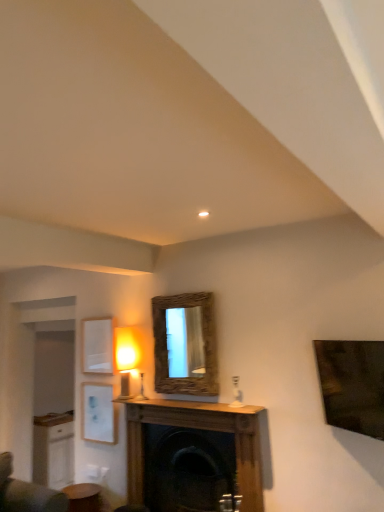
This screenshot has height=512, width=384. What do you see at coordinates (192, 455) in the screenshot?
I see `wooden fireplace at center` at bounding box center [192, 455].

This screenshot has height=512, width=384. Describe the element at coordinates (97, 346) in the screenshot. I see `white matte picture frame at upper left, the first picture frame from the top` at that location.

This screenshot has height=512, width=384. What do you see at coordinates (187, 344) in the screenshot?
I see `wooden mirror at center` at bounding box center [187, 344].

The image size is (384, 512). What do you see at coordinates (84, 497) in the screenshot?
I see `wooden table at lower left` at bounding box center [84, 497].

Measure the distance between point (x=42, y=431) and camera.

The depth of point (x=42, y=431) is 6.04 meters.

Measure the distance between white wood cabinet at lower left and camera.

5.93 meters.

Locate an element on the screen. The width and height of the screenshot is (384, 512). white matte picture frame at lower left, the 2th picture frame in the top-to-bottom sequence is located at coordinates (98, 413).

Is matte white table lamp at upper left, which is counted as the 1th table lamp, starting from the left, oriented towards wooden mirror at center?

No, matte white table lamp at upper left, which is counted as the 1th table lamp, starting from the left, is not facing towards wooden mirror at center.

Considering the sizes of objects matte white table lamp at upper left, which is counted as the 1th table lamp, starting from the left, and wooden mirror at center in the image provided, who is taller, matte white table lamp at upper left, which is counted as the 1th table lamp, starting from the left, or wooden mirror at center?

Standing taller between the two is wooden mirror at center.

Is point (134, 343) closer or farther from the camera than point (204, 309)?

Point (134, 343).

Does point (203, 416) lie in front of point (91, 362)?

That is True.

Is wooden fireplace at center positioned far away from white matte picture frame at upper left, the first picture frame from the top?

wooden fireplace at center is positioned a significant distance from white matte picture frame at upper left, the first picture frame from the top.

Is wooden fireplace at center wider than white matte picture frame at upper left, which appears as the second picture frame when ordered from the bottom?

Indeed, wooden fireplace at center has a greater width compared to white matte picture frame at upper left, which appears as the second picture frame when ordered from the bottom.

From the image's perspective, is wooden fireplace at center on top of white matte picture frame at upper left, which appears as the second picture frame when ordered from the bottom?

No, from the image's perspective, wooden fireplace at center is not over white matte picture frame at upper left, which appears as the second picture frame when ordered from the bottom.

Can you confirm if matte white table lamp at upper left, which is counted as the 1th table lamp, starting from the left, is shorter than matte white glass at center, which is counted as the second table lamp, starting from the left?

No, matte white table lamp at upper left, which is counted as the 1th table lamp, starting from the left, is not shorter than matte white glass at center, which is counted as the second table lamp, starting from the left.

Where is `table lamp that is above the matte white glass at center, acting as the 1th table lamp starting from the right (from the image's perspective)`? table lamp that is above the matte white glass at center, acting as the 1th table lamp starting from the right (from the image's perspective) is located at coordinates (126, 359).

Can you confirm if matte white table lamp at upper left, which is counted as the 1th table lamp, starting from the left, is positioned to the left of matte white glass at center, acting as the 1th table lamp starting from the right?

Correct, you'll find matte white table lamp at upper left, which is counted as the 1th table lamp, starting from the left, to the left of matte white glass at center, acting as the 1th table lamp starting from the right.

Based on the photo, is white matte picture frame at upper left, the first picture frame from the top, situated inside matte white table lamp at upper left, which is counted as the 1th table lamp, starting from the left, or outside?

The correct answer is: outside.

What's the angular difference between white matte picture frame at upper left, which appears as the second picture frame when ordered from the bottom, and matte white table lamp at upper left, the 2th table lamp viewed from the right,'s facing directions?

0.00182 degrees separate the facing orientations of white matte picture frame at upper left, which appears as the second picture frame when ordered from the bottom, and matte white table lamp at upper left, the 2th table lamp viewed from the right.

Does white matte picture frame at upper left, which appears as the second picture frame when ordered from the bottom, appear on the right side of matte white table lamp at upper left, which is counted as the 1th table lamp, starting from the left?

In fact, white matte picture frame at upper left, which appears as the second picture frame when ordered from the bottom, is to the left of matte white table lamp at upper left, which is counted as the 1th table lamp, starting from the left.

Does white matte picture frame at upper left, which appears as the second picture frame when ordered from the bottom, touch matte white table lamp at upper left, which is counted as the 1th table lamp, starting from the left?

No, white matte picture frame at upper left, which appears as the second picture frame when ordered from the bottom, is not next to matte white table lamp at upper left, which is counted as the 1th table lamp, starting from the left.

Considering the positions of objects matte white glass at center, which is counted as the second table lamp, starting from the left, and matte white table lamp at upper left, the 2th table lamp viewed from the right, in the image provided, who is in front, matte white glass at center, which is counted as the second table lamp, starting from the left, or matte white table lamp at upper left, the 2th table lamp viewed from the right,?

matte white glass at center, which is counted as the second table lamp, starting from the left, is more forward.

Is matte white glass at center, acting as the 1th table lamp starting from the right, taller than matte white table lamp at upper left, which is counted as the 1th table lamp, starting from the left?

No, matte white glass at center, acting as the 1th table lamp starting from the right, is not taller than matte white table lamp at upper left, which is counted as the 1th table lamp, starting from the left.

Is matte white glass at center, acting as the 1th table lamp starting from the right, surrounding matte white table lamp at upper left, which is counted as the 1th table lamp, starting from the left?

That's incorrect, matte white table lamp at upper left, which is counted as the 1th table lamp, starting from the left, is not inside matte white glass at center, acting as the 1th table lamp starting from the right.

Locate an element on the screen. Image resolution: width=384 pixels, height=512 pixels. table lamp that appears above the matte white glass at center, acting as the 1th table lamp starting from the right (from the image's perspective) is located at coordinates (126, 359).

Which of these two, white matte picture frame at lower left, the first picture frame in the bottom-to-top sequence, or wooden table at lower left, stands taller?

white matte picture frame at lower left, the first picture frame in the bottom-to-top sequence.

Who is smaller, white matte picture frame at lower left, the 2th picture frame in the top-to-bottom sequence, or wooden table at lower left?

white matte picture frame at lower left, the 2th picture frame in the top-to-bottom sequence.

Is wooden table at lower left at the back of white matte picture frame at lower left, the 2th picture frame in the top-to-bottom sequence?

That's not correct — white matte picture frame at lower left, the 2th picture frame in the top-to-bottom sequence, is not looking away from wooden table at lower left.

Where is `table that is under the white matte picture frame at lower left, the first picture frame in the bottom-to-top sequence (from a real-world perspective)`? table that is under the white matte picture frame at lower left, the first picture frame in the bottom-to-top sequence (from a real-world perspective) is located at coordinates (84, 497).

Is wooden table at lower left inside or outside of white wood cabinet at lower left?

wooden table at lower left cannot be found inside white wood cabinet at lower left.

You are a GUI agent. You are given a task and a screenshot of the screen. Output one action in this format:
    pyautogui.click(x=<x>, y=<y>)
    Task: Click on the cabinetry located behind the wooden table at lower left
    The image size is (384, 512).
    Given the screenshot: What is the action you would take?
    pyautogui.click(x=53, y=450)

Which is more to the right, wooden table at lower left or white wood cabinet at lower left?

wooden table at lower left.

Locate an element on the screen. The width and height of the screenshot is (384, 512). mirror in front of the matte white table lamp at upper left, which is counted as the 1th table lamp, starting from the left is located at coordinates [x=187, y=344].

The width and height of the screenshot is (384, 512). Identify the location of the 2nd picture frame above when counting from the wooden fireplace at center (from the image's perspective). (97, 346).

Considering their positions, is white matte picture frame at lower left, the 2th picture frame in the top-to-bottom sequence, positioned further to wooden mirror at center than wooden fireplace at center?

white matte picture frame at lower left, the 2th picture frame in the top-to-bottom sequence, is positioned further to the anchor wooden mirror at center.

From the image, which object appears to be farther from white matte picture frame at lower left, the first picture frame in the bottom-to-top sequence, wooden fireplace at center or white wood cabinet at lower left?

Among the two, white wood cabinet at lower left is located further to white matte picture frame at lower left, the first picture frame in the bottom-to-top sequence.

Based on their spatial positions, is matte white glass at center, which is counted as the second table lamp, starting from the left, or matte white table lamp at upper left, the 2th table lamp viewed from the right, further from wooden fireplace at center?

matte white table lamp at upper left, the 2th table lamp viewed from the right, is positioned further to the anchor wooden fireplace at center.

Estimate the real-world distances between objects in this image. Which object is closer to white matte picture frame at lower left, the first picture frame in the bottom-to-top sequence, wooden mirror at center or wooden fireplace at center?

Among the two, wooden fireplace at center is located nearer to white matte picture frame at lower left, the first picture frame in the bottom-to-top sequence.

Consider the image. When comparing their distances from wooden mirror at center, does matte white glass at center, which is counted as the second table lamp, starting from the left, or white matte picture frame at lower left, the 2th picture frame in the top-to-bottom sequence, seem further?

white matte picture frame at lower left, the 2th picture frame in the top-to-bottom sequence.

From the image, which object appears to be nearer to wooden fireplace at center, matte white glass at center, which is counted as the second table lamp, starting from the left, or wooden table at lower left?

matte white glass at center, which is counted as the second table lamp, starting from the left, is positioned closer to the anchor wooden fireplace at center.

Looking at the image, which one is located further to white matte picture frame at lower left, the first picture frame in the bottom-to-top sequence, wooden fireplace at center or matte white table lamp at upper left, which is counted as the 1th table lamp, starting from the left?

wooden fireplace at center lies further to white matte picture frame at lower left, the first picture frame in the bottom-to-top sequence, than the other object.

From the image, which object appears to be nearer to white matte picture frame at upper left, the first picture frame from the top, wooden mirror at center or matte white table lamp at upper left, which is counted as the 1th table lamp, starting from the left?

Among the two, matte white table lamp at upper left, which is counted as the 1th table lamp, starting from the left, is located nearer to white matte picture frame at upper left, the first picture frame from the top.

At what (x,y) coordinates should I click in order to perform the action: click on picture frame between white matte picture frame at upper left, the first picture frame from the top, and wooden table at lower left from top to bottom. Please return your answer as a coordinate pair (x, y). This screenshot has width=384, height=512. Looking at the image, I should click on (98, 413).

Find the location of `fireplace between white matte picture frame at upper left, which appears as the second picture frame when ordered from the bottom, and wooden table at lower left from top to bottom`. fireplace between white matte picture frame at upper left, which appears as the second picture frame when ordered from the bottom, and wooden table at lower left from top to bottom is located at coordinates (192, 455).

In order to click on table lamp between matte white table lamp at upper left, the 2th table lamp viewed from the right, and white matte picture frame at lower left, the first picture frame in the bottom-to-top sequence, in the up-down direction in this screenshot , I will do `click(141, 389)`.

Find the location of `table between white matte picture frame at upper left, the first picture frame from the top, and white wood cabinet at lower left from top to bottom`. table between white matte picture frame at upper left, the first picture frame from the top, and white wood cabinet at lower left from top to bottom is located at coordinates (84, 497).